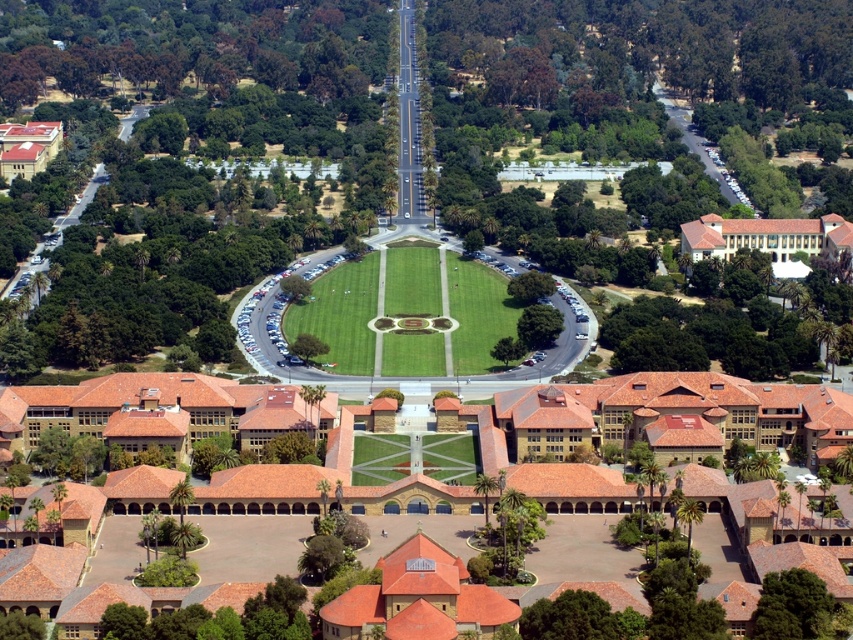
In the scene shown: You are a maintenance worker needing to water the green leafy tree at center. You are currently standing on the green grassy field at center with a hose that can reach up to 20 meters. Can you water the tree without moving from your current position?

The distance between the green grassy field at center and the green leafy tree at center is 24.05 meters, which is beyond the 20 meter reach of the hose. You will need to move closer to water the tree.

You are planning to host a large outdoor event on the campus. You need to choose between setting it up on the green grassy field at center or under the green leafy tree at lower right. Based on the space available, which location would accommodate more people?

The green grassy field at center has a greater width than the green leafy tree at lower right, so it can accommodate more people.